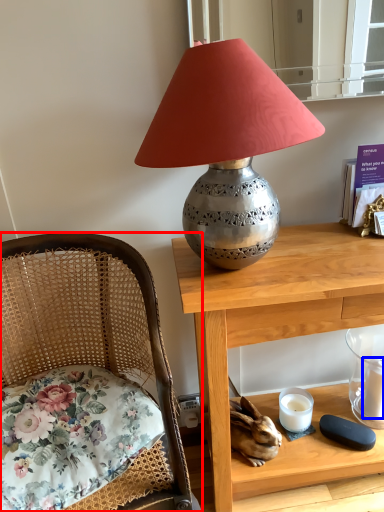
Question: Which object appears closest to the camera in this image, chair (highlighted by a red box) or candle (highlighted by a blue box)?

Choices:
 (A) chair
 (B) candle

Answer: (A)